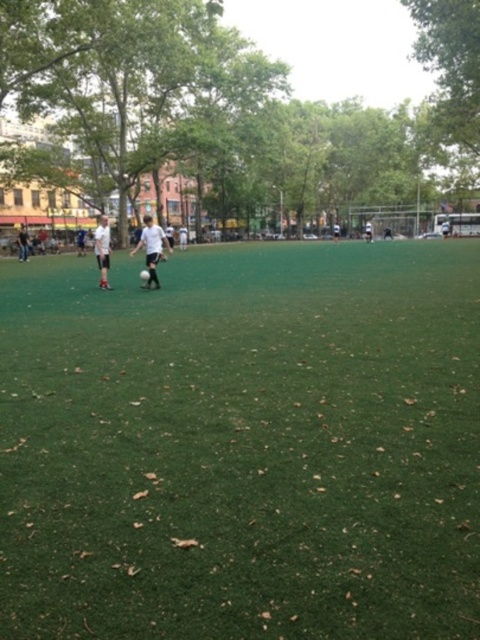
Question: Which object appears farthest from the camera in this image?

Choices:
 (A) white matte soccer ball at center
 (B) green artificial turf at center
 (C) white matte soccer player at left
 (D) white matte soccer player at center

Answer: (C)

Question: Can you confirm if green artificial turf at center is positioned above white matte soccer player at center?

Choices:
 (A) no
 (B) yes

Answer: (A)

Question: Estimate the real-world distances between objects in this image. Which object is closer to the white matte soccer player at left?

Choices:
 (A) green artificial turf at center
 (B) white matte soccer ball at center
 (C) white matte soccer player at center

Answer: (C)

Question: Can you confirm if green artificial turf at center is positioned below white matte soccer player at center?

Choices:
 (A) yes
 (B) no

Answer: (A)

Question: Can you confirm if green artificial turf at center is wider than white matte soccer ball at center?

Choices:
 (A) no
 (B) yes

Answer: (B)

Question: Which point is closer to the camera?

Choices:
 (A) (257, 273)
 (B) (103, 284)
 (C) (153, 243)

Answer: (C)